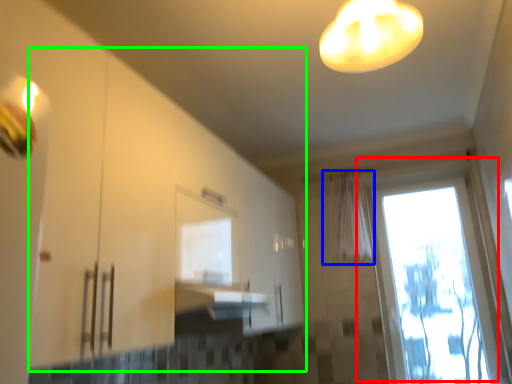
Question: Which is farther away from window (highlighted by a red box)? curtain (highlighted by a blue box) or cabinetry (highlighted by a green box)?

Choices:
 (A) curtain
 (B) cabinetry

Answer: (B)